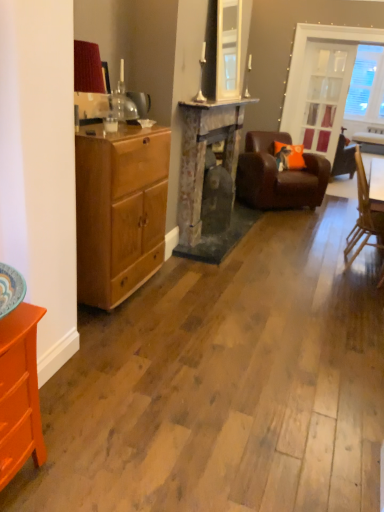
Find the location of a particular element. The height and width of the screenshot is (512, 384). vacant space behind orange painted wood dresser at lower left is located at coordinates pos(69,415).